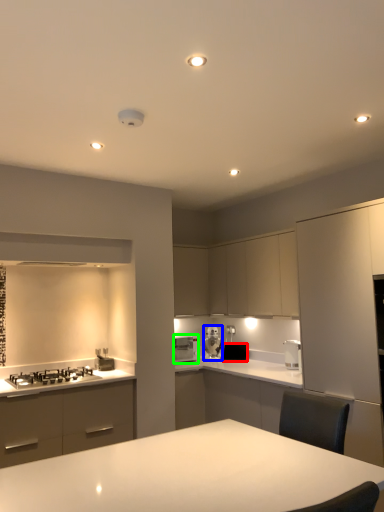
Question: Which object is positioned farthest from appliance (highlighted by a red box)? Select from kitchen appliance (highlighted by a blue box) and kitchen appliance (highlighted by a green box).

Choices:
 (A) kitchen appliance
 (B) kitchen appliance

Answer: (B)